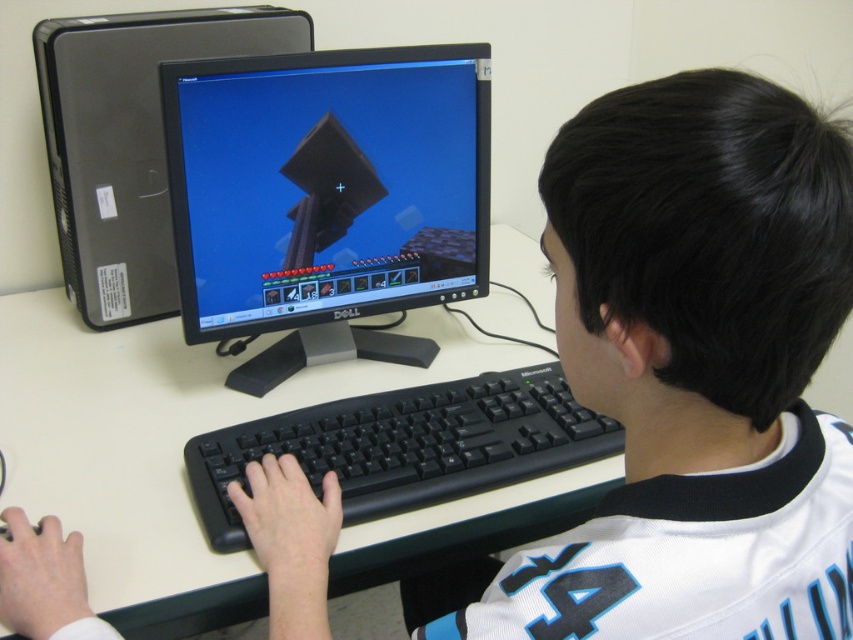
You are setting up a new monitor and need to decide between placing it on the white plastic computer desk at center or the black plastic desktop at upper left. Which surface is shorter and thus better suited for a monitor that requires a lower height placement?

The white plastic computer desk at center has a lesser height compared to the black plastic desktop at upper left, so it is better suited for placing the monitor that requires a lower height placement.

You are organizing a study area and need to place both the matte black monitor at center and the white plastic computer desk at center in a small room. Based on their sizes, which object should you place first to ensure they both fit properly?

The matte black monitor at center occupies less space than the white plastic computer desk at center, so you should place the white plastic computer desk at center first to ensure there is enough space left for the smaller monitor.

You are organizing a study space and need to place a new bookshelf. The white plastic computer desk at center and the black plastic desktop at upper left are already in the room. Based on their positions, where should you place the bookshelf so it aligns with the existing furniture?

Result: The white plastic computer desk at center is below the black plastic desktop at upper left, so placing the bookshelf to the side or behind the white plastic computer desk at center would maintain alignment with the existing setup.